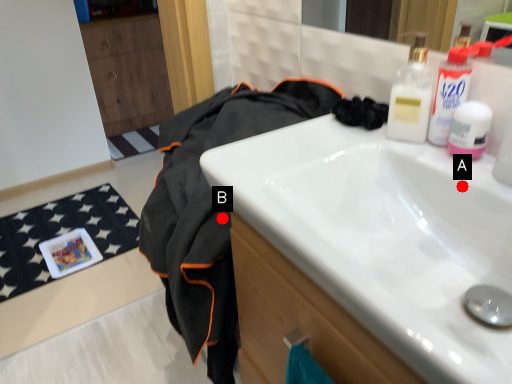
Question: Two points are circled on the image, labeled by A and B beside each circle. Which point appears closest to the camera in this image?

Choices:
 (A) A is closer
 (B) B is closer

Answer: (A)